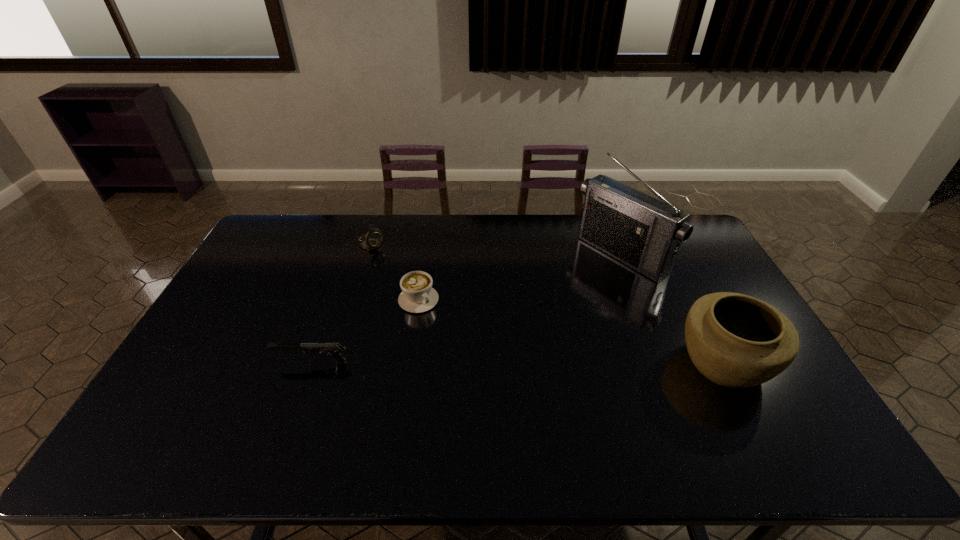
Where is `free spot located 0.280m on the face of the third shortest object`? free spot located 0.280m on the face of the third shortest object is located at coordinates (426, 289).

This screenshot has width=960, height=540. Identify the location of vacant space located 0.220m on the face of the third shortest object. (416, 280).

At what (x,y) coordinates should I click in order to perform the action: click on vacant space situated 0.080m to the right of the cappuccino's handle. Please return your answer as a coordinate pair (x, y). The image size is (960, 540). Looking at the image, I should click on (443, 327).

In order to click on vacant space situated 0.180m to the right of the cappuccino's handle in this screenshot , I will do `click(462, 348)`.

Find the location of a particular element. vacant area located 0.330m to the right of the cappuccino's handle is located at coordinates (493, 383).

Where is `vacant position located on the front-facing side of the radio receiver`? vacant position located on the front-facing side of the radio receiver is located at coordinates (536, 316).

The image size is (960, 540). I want to click on vacant space positioned 0.250m on the front-facing side of the radio receiver, so click(x=545, y=310).

This screenshot has width=960, height=540. In order to click on vacant space located on the front-facing side of the radio receiver in this screenshot , I will do `click(566, 295)`.

In order to click on compass positioned at the far edge in this screenshot , I will do `click(372, 240)`.

In order to click on radio receiver located at the far edge in this screenshot , I will do `click(645, 233)`.